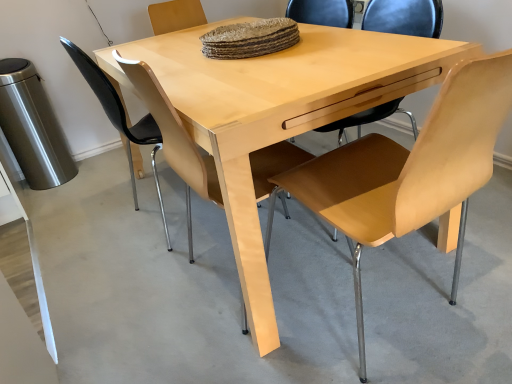
Question: Is light wood chair at center, the second chair in the left-to-right sequence, at the left side of light brown leather chair at center, which is the 1th chair in left-to-right order?

Choices:
 (A) no
 (B) yes

Answer: (A)

Question: Can you confirm if light wood chair at center, the second chair in the left-to-right sequence, is bigger than light brown leather chair at center, which is the 1th chair in left-to-right order?

Choices:
 (A) no
 (B) yes

Answer: (B)

Question: Is light wood chair at center, which is counted as the second chair, starting from the right, facing towards light brown leather chair at center, the 3th chair viewed from the right?

Choices:
 (A) no
 (B) yes

Answer: (A)

Question: From the image's perspective, is light wood chair at center, the second chair in the left-to-right sequence, below light brown leather chair at center, the 3th chair viewed from the right?

Choices:
 (A) yes
 (B) no

Answer: (A)

Question: Is light wood chair at center, which is counted as the second chair, starting from the right, oriented away from light brown leather chair at center, the 3th chair viewed from the right?

Choices:
 (A) yes
 (B) no

Answer: (B)

Question: From the image's perspective, is light brown wood chair at center, which is counted as the 1th chair, starting from the right, above or below light wood table at center?

Choices:
 (A) above
 (B) below

Answer: (B)

Question: Choose the correct answer: Is light brown wood chair at center, the third chair when ordered from left to right, inside light wood table at center or outside it?

Choices:
 (A) outside
 (B) inside

Answer: (A)

Question: Is light brown wood chair at center, the third chair when ordered from left to right, taller or shorter than light wood table at center?

Choices:
 (A) tall
 (B) short

Answer: (A)

Question: Considering their positions, is light brown wood chair at center, the third chair when ordered from left to right, located in front of or behind light wood table at center?

Choices:
 (A) front
 (B) behind

Answer: (A)

Question: From a real-world perspective, is light brown leather chair at center, which is the 1th chair in left-to-right order, positioned above or below light wood chair at center, which is counted as the second chair, starting from the right?

Choices:
 (A) below
 (B) above

Answer: (B)

Question: From their relative heights in the image, would you say light brown leather chair at center, which is the 1th chair in left-to-right order, is taller or shorter than light wood chair at center, the second chair in the left-to-right sequence?

Choices:
 (A) tall
 (B) short

Answer: (B)

Question: Is light brown leather chair at center, which is the 1th chair in left-to-right order, in front of or behind light wood chair at center, which is counted as the second chair, starting from the right, in the image?

Choices:
 (A) front
 (B) behind

Answer: (B)

Question: In the image, is light brown leather chair at center, the 3th chair viewed from the right, on the left side or the right side of light wood chair at center, the second chair in the left-to-right sequence?

Choices:
 (A) right
 (B) left

Answer: (B)

Question: From a real-world perspective, relative to light brown wood chair at center, which is counted as the 1th chair, starting from the right, is light wood table at center vertically above or below?

Choices:
 (A) above
 (B) below

Answer: (B)

Question: From their relative heights in the image, would you say light wood table at center is taller or shorter than light brown wood chair at center, which is counted as the 1th chair, starting from the right?

Choices:
 (A) tall
 (B) short

Answer: (B)